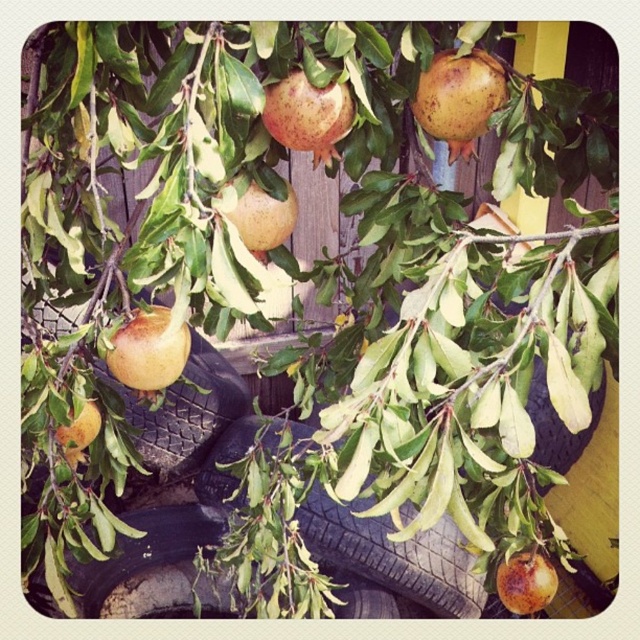
You are a gardener trying to place a small potted plant between the black rubber tire at lower right and the rusty metallic pomegranate at lower right. Based on their heights, which object should the plant be placed closer to in order to ensure stability?

The black rubber tire at lower right has a greater height compared to the rusty metallic pomegranate at lower right. To ensure stability, the potted plant should be placed closer to the black rubber tire at lower right since it provides a higher base.

You are a gardener who needs to place a new plant pot that is 30 inches wide between the black rubber tire at lower right and the rusty metallic pomegranate at lower right. Can the pot fit between them without overlapping either object?

The black rubber tire at lower right and rusty metallic pomegranate at lower right are 32.40 inches apart. Since the pot is 30 inches wide, it can fit between them as the distance is slightly larger than the pot.

You are standing at the base of the pomegranate tree and see the black rubber tire at lower right. If you want to move directly towards the tire, which direction should you walk from the tree?

Since the black rubber tire at lower right is located at point 0.661 on the x and 0.872 on the y, you should walk towards the lower right direction from the tree to reach it.